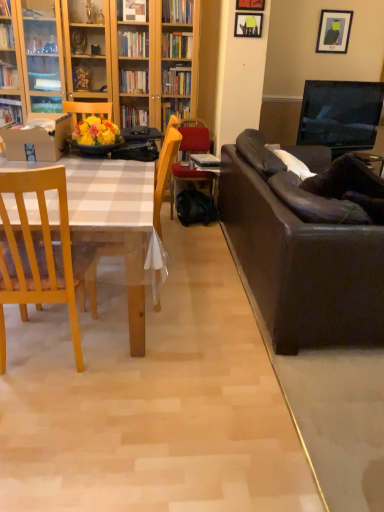
Question: Would you say wooden chair at center, positioned as the first chair in back-to-front order, contains matte black picture frame at upper center, which ranks as the second picture frame in back-to-front order?

Choices:
 (A) yes
 (B) no

Answer: (B)

Question: Is wooden chair at center, the 3th chair when ordered from front to back, far away from matte black picture frame at upper center, acting as the first picture frame starting from the left?

Choices:
 (A) yes
 (B) no

Answer: (A)

Question: From the image's perspective, would you say wooden chair at center, the 3th chair when ordered from front to back, is shown under matte black picture frame at upper center, acting as the first picture frame starting from the left?

Choices:
 (A) yes
 (B) no

Answer: (A)

Question: Can you see wooden chair at center, positioned as the first chair in back-to-front order, touching matte black picture frame at upper center, acting as the first picture frame starting from the left?

Choices:
 (A) yes
 (B) no

Answer: (B)

Question: Is matte black picture frame at upper center, the second picture frame in the front-to-back sequence, at the back of wooden chair at center, positioned as the first chair in back-to-front order?

Choices:
 (A) yes
 (B) no

Answer: (B)

Question: Is point (329, 52) closer or farther from the camera than point (162, 267)?

Choices:
 (A) farther
 (B) closer

Answer: (A)

Question: Is matte black picture frame at upper right, which is the 3th picture frame in left-to-right order, spatially inside wooden chair at center, the second chair from the back, or outside of it?

Choices:
 (A) outside
 (B) inside

Answer: (A)

Question: Is matte black picture frame at upper right, which is the 3th picture frame in left-to-right order, bigger or smaller than wooden chair at center, arranged as the 2th chair when viewed from the front?

Choices:
 (A) small
 (B) big

Answer: (A)

Question: Based on their positions, is matte black picture frame at upper right, placed as the first picture frame when sorted from right to left, located to the left or right of wooden chair at center, the second chair from the back?

Choices:
 (A) left
 (B) right

Answer: (B)

Question: Is point (41, 261) closer or farther from the camera than point (9, 140)?

Choices:
 (A) farther
 (B) closer

Answer: (B)

Question: Choose the correct answer: Is light wood chair at left, the 3th chair when ordered from back to front, inside matte cardboard box at left or outside it?

Choices:
 (A) outside
 (B) inside

Answer: (A)

Question: Is light wood chair at left, the 3th chair when ordered from back to front, wider or thinner than matte cardboard box at left?

Choices:
 (A) thin
 (B) wide

Answer: (A)

Question: Is light wood chair at left, the 3th chair when ordered from back to front, taller or shorter than matte cardboard box at left?

Choices:
 (A) short
 (B) tall

Answer: (B)

Question: Is wooden picture frame at upper center, placed as the 2th picture frame when sorted from right to left, in front of or behind light wood chair at left, the 3th chair when ordered from back to front, in the image?

Choices:
 (A) behind
 (B) front

Answer: (A)

Question: Is wooden picture frame at upper center, placed as the 2th picture frame when sorted from right to left, inside the boundaries of light wood chair at left, the 3th chair when ordered from back to front, or outside?

Choices:
 (A) inside
 (B) outside

Answer: (B)